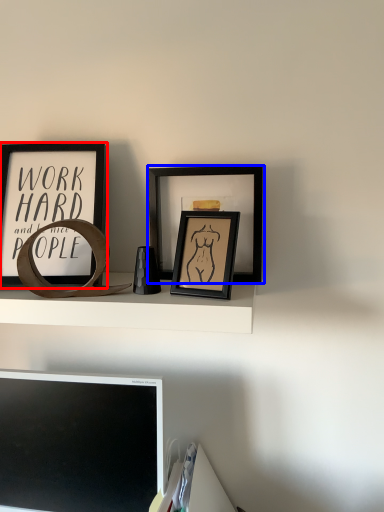
Question: Which object appears closest to the camera in this image, picture frame (highlighted by a red box) or picture frame (highlighted by a blue box)?

Choices:
 (A) picture frame
 (B) picture frame

Answer: (A)